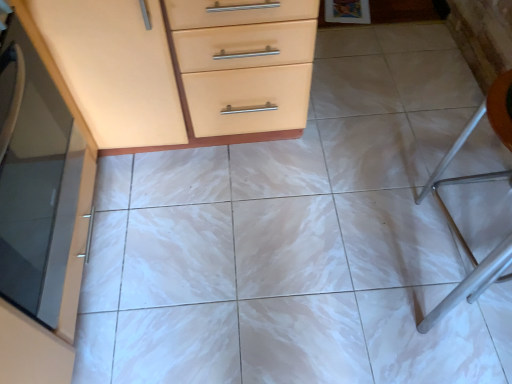
Locate an element on the screen. vacant area on the back side of orange plastic folding chair at right is located at coordinates (428, 152).